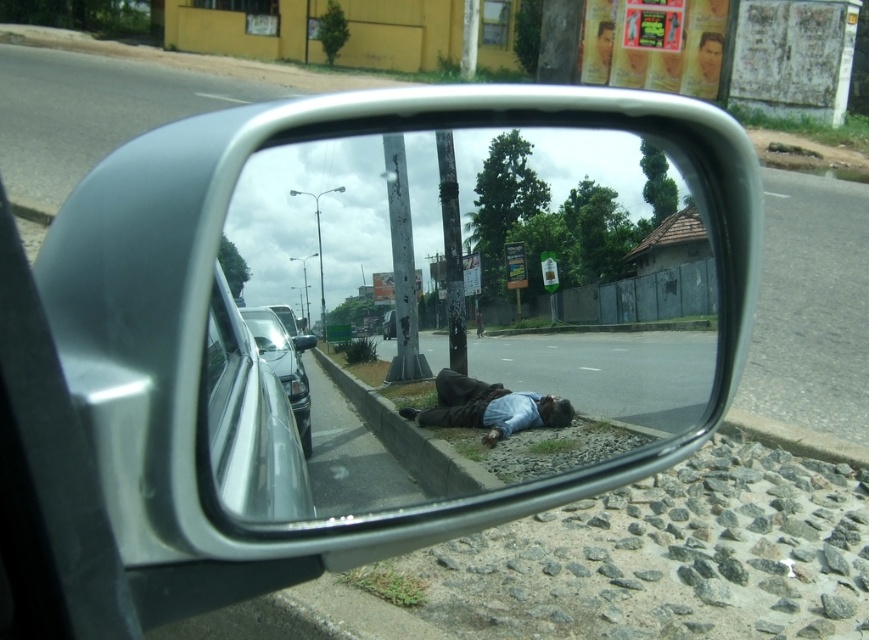
Question: Does clear glass car window at lower left come in front of shiny black car at lower center?

Choices:
 (A) yes
 (B) no

Answer: (A)

Question: Estimate the real-world distances between objects in this image. Which object is farther from the clear glass car window at lower left?

Choices:
 (A) shiny black car at lower center
 (B) shiny silver car at lower left

Answer: (A)

Question: Is clear glass mirror at center wider than shiny silver car at lower left?

Choices:
 (A) yes
 (B) no

Answer: (A)

Question: Does dark blue fabric man at lower center lie behind shiny silver car at lower left?

Choices:
 (A) no
 (B) yes

Answer: (A)

Question: Based on their relative distances, which object is nearer to the clear glass mirror at center?

Choices:
 (A) dark blue fabric man at lower center
 (B) shiny silver car at lower left

Answer: (A)

Question: Which object appears closest to the camera in this image?

Choices:
 (A) shiny black car at lower center
 (B) shiny silver car at lower left

Answer: (B)